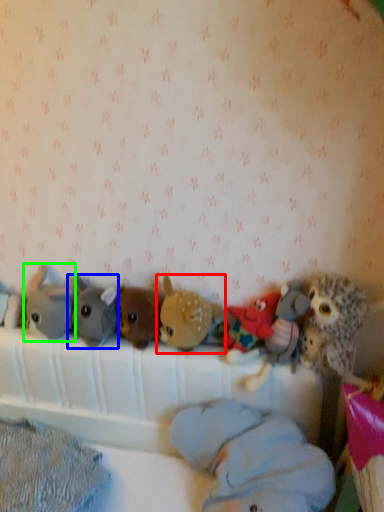
Question: Which is farther away from toy (highlighted by a red box)? toy (highlighted by a blue box) or toy (highlighted by a green box)?

Choices:
 (A) toy
 (B) toy

Answer: (B)